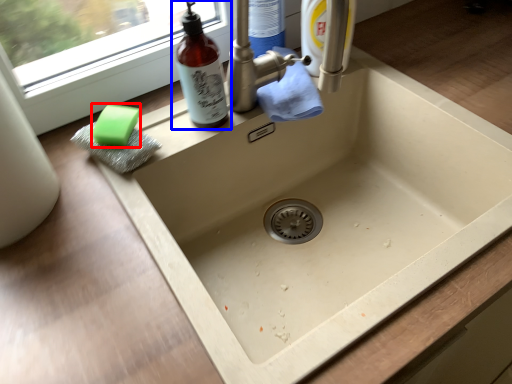
Question: Which point is further to the camera, soap (highlighted by a red box) or bottle (highlighted by a blue box)?

Choices:
 (A) soap
 (B) bottle

Answer: (A)